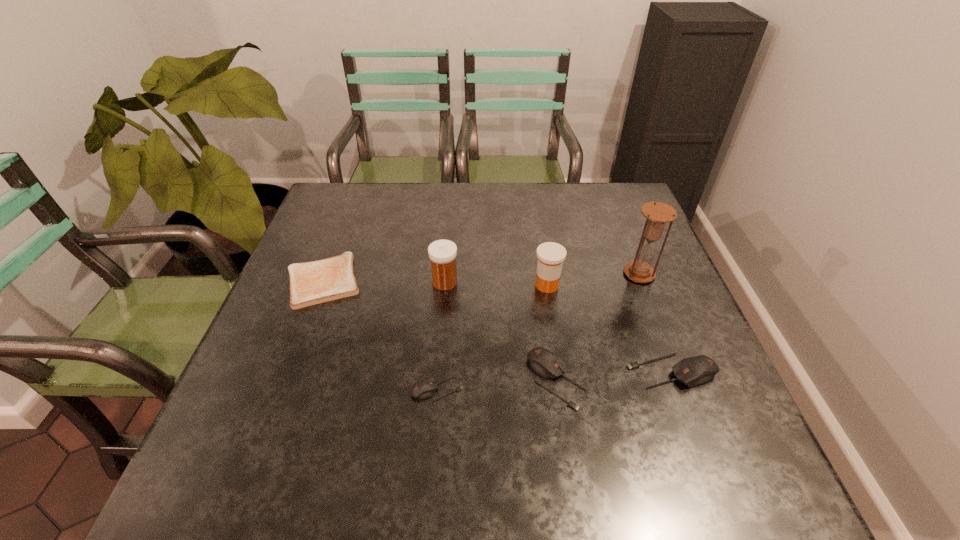
Considering the uniform spacing of mouses, where should an additional mouse be positioned on the left? Please locate a free spot. Please provide its 2D coordinates. Your answer should be formatted as a tuple, i.e. [(x, y)], where the tuple contains the x and y coordinates of a point satisfying the conditions above.

[(313, 400)]